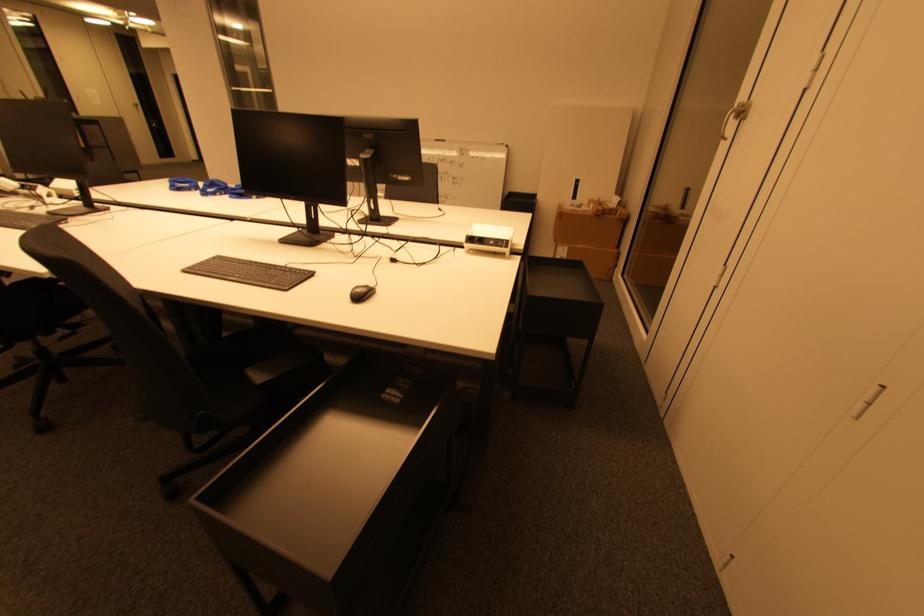
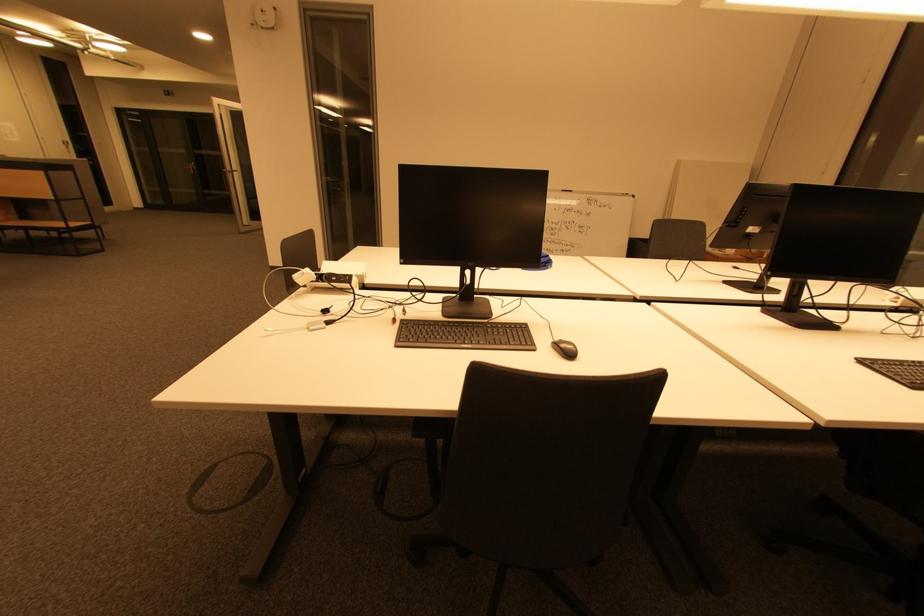
Question: What movement of the cameraman would produce the second image?

Choices:
 (A) Left
 (B) Right
 (C) Forward
 (D) Backward

Answer: (A)